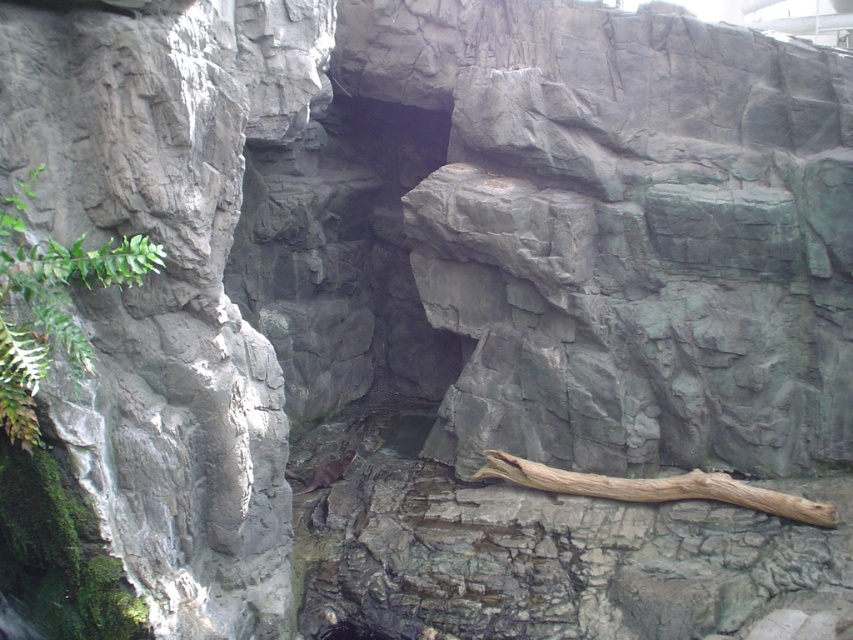
Consider the image. You are a zookeeper preparing to place a new green leafy plant at left in the enclosure. The exhibit requires that this plant be positioned exactly at the coordinates point (x=50, y=305). Can you confirm if this location is suitable based on the existing setup?

The green leafy plant at left is already located at point (x=50, y=305), so the location is suitable for placing the new plant there.

You are a zookeeper who needs to place a food bowl for the brown furry animal at center. The bowl requires a stable surface at least 1 meter away from the animal. Can the brown rough log at lower center serve as a suitable surface for the bowl?

The distance between the brown rough log at lower center and the brown furry animal at center is 1.07 meters, which is more than 1 meter. Therefore, the brown rough log at lower center can be used as a stable surface for the food bowl.

You are a zookeeper preparing to place a new brown furry animal at center into its enclosure. The enclosure already has a green leafy plant at left. Which object takes up more space in the enclosure?

The green leafy plant at left is larger in size than the brown furry animal at center, so it takes up more space in the enclosure.